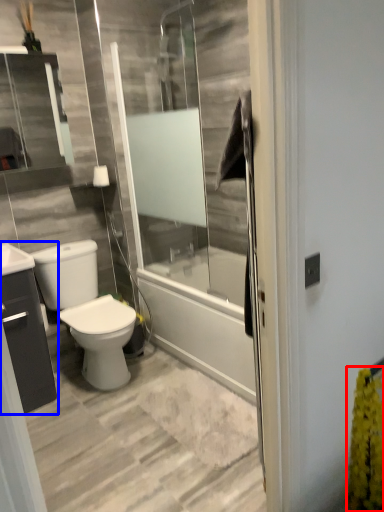
Question: Which object appears farthest to the camera in this image, flower (highlighted by a red box) or bathroom cabinet (highlighted by a blue box)?

Choices:
 (A) flower
 (B) bathroom cabinet

Answer: (B)